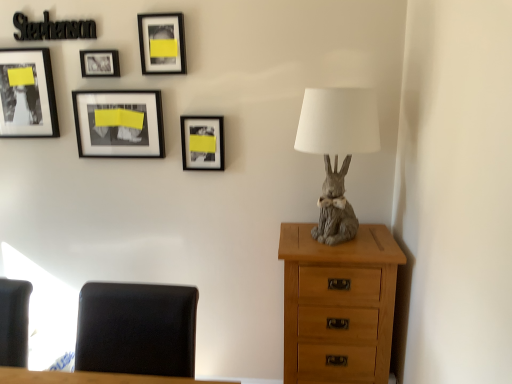
Describe the element at coordinates (99, 63) in the screenshot. I see `matte black picture frame at upper left, marked as the fourth picture frame in a right-to-left arrangement` at that location.

In order to click on matte black frame at upper center, which is counted as the 2th picture frame, starting from the right in this screenshot , I will do `click(162, 43)`.

Image resolution: width=512 pixels, height=384 pixels. Describe the element at coordinates (338, 304) in the screenshot. I see `light brown wood chest of drawers at right` at that location.

At what (x,y) coordinates should I click in order to perform the action: click on matte black picture frame at center, which is the first picture frame in right-to-left order. Please return your answer as a coordinate pair (x, y). This screenshot has width=512, height=384. Looking at the image, I should click on (202, 142).

What do you see at coordinates (202, 142) in the screenshot? I see `matte black picture frame at center, which is the first picture frame in right-to-left order` at bounding box center [202, 142].

Where is `gray textured rabbit at right`? Image resolution: width=512 pixels, height=384 pixels. gray textured rabbit at right is located at coordinates (337, 149).

How far apart are black leather chair at lower left and matte black picture frame at upper left, the 2th picture frame in the left-to-right sequence?

The distance of black leather chair at lower left from matte black picture frame at upper left, the 2th picture frame in the left-to-right sequence, is 1.18 meters.

Locate an element on the screen. The width and height of the screenshot is (512, 384). furniture located below the matte black picture frame at upper left, marked as the fourth picture frame in a right-to-left arrangement (from the image's perspective) is located at coordinates (136, 329).

Considering the sizes of objects black leather chair at lower left and matte black picture frame at upper left, marked as the fourth picture frame in a right-to-left arrangement, in the image provided, who is wider, black leather chair at lower left or matte black picture frame at upper left, marked as the fourth picture frame in a right-to-left arrangement,?

black leather chair at lower left.

Is black leather chair at lower left bigger or smaller than matte black picture frame at upper left, marked as the fourth picture frame in a right-to-left arrangement?

black leather chair at lower left is bigger than matte black picture frame at upper left, marked as the fourth picture frame in a right-to-left arrangement.

Is matte black picture frame at center, which is counted as the fifth picture frame, starting from the left, oriented away from matte black frame at upper center, marked as the 4th picture frame in a left-to-right arrangement?

No.

How many degrees apart are the facing directions of matte black picture frame at center, which is counted as the fifth picture frame, starting from the left, and matte black frame at upper center, marked as the 4th picture frame in a left-to-right arrangement?

The angular difference between matte black picture frame at center, which is counted as the fifth picture frame, starting from the left, and matte black frame at upper center, marked as the 4th picture frame in a left-to-right arrangement, is 0.00259 degrees.

From the picture: Considering the sizes of objects matte black picture frame at center, which is counted as the fifth picture frame, starting from the left, and matte black frame at upper center, marked as the 4th picture frame in a left-to-right arrangement, in the image provided, who is thinner, matte black picture frame at center, which is counted as the fifth picture frame, starting from the left, or matte black frame at upper center, marked as the 4th picture frame in a left-to-right arrangement,?

With smaller width is matte black frame at upper center, marked as the 4th picture frame in a left-to-right arrangement.

How much distance is there between matte black picture frame at center, which is counted as the fifth picture frame, starting from the left, and matte black frame at upper center, marked as the 4th picture frame in a left-to-right arrangement?

They are 13.73 inches apart.

From the image's perspective, is light brown wood chest of drawers at right positioned above or below gray textured rabbit at right?

light brown wood chest of drawers at right is situated lower than gray textured rabbit at right in the image.

Which is more to the left, light brown wood chest of drawers at right or gray textured rabbit at right?

From the viewer's perspective, gray textured rabbit at right appears more on the left side.

From a real-world perspective, is light brown wood chest of drawers at right physically located above or below gray textured rabbit at right?

Clearly, from a real-world perspective, light brown wood chest of drawers at right is below gray textured rabbit at right.

Is light brown wood chest of drawers at right inside or outside of matte black frame at upper left, which ranks as the first picture frame in left-to-right order?

The correct answer is: outside.

Where is `the 5th picture frame to the left of the light brown wood chest of drawers at right, starting your count from the anchor`? The image size is (512, 384). the 5th picture frame to the left of the light brown wood chest of drawers at right, starting your count from the anchor is located at coordinates (27, 94).

Considering the sizes of light brown wood chest of drawers at right and matte black frame at upper left, the fifth picture frame in the right-to-left sequence, in the image, is light brown wood chest of drawers at right taller or shorter than matte black frame at upper left, the fifth picture frame in the right-to-left sequence,?

light brown wood chest of drawers at right is taller than matte black frame at upper left, the fifth picture frame in the right-to-left sequence.

Who is more distant, light brown wood chest of drawers at right or matte black frame at upper left, the fifth picture frame in the right-to-left sequence?

matte black frame at upper left, the fifth picture frame in the right-to-left sequence, is more distant.

Is black matte picture frame at upper left, the 3th picture frame from the right, positioned beyond the bounds of matte black picture frame at center, which is counted as the fifth picture frame, starting from the left?

That's correct, black matte picture frame at upper left, the 3th picture frame from the right, is outside of matte black picture frame at center, which is counted as the fifth picture frame, starting from the left.

Which picture frame is the 1st one when counting from the front of the black matte picture frame at upper left, arranged as the third picture frame when viewed from the left? Please provide its 2D coordinates.

[(202, 142)]

How many degrees apart are the facing directions of black matte picture frame at upper left, the 3th picture frame from the right, and matte black picture frame at center, which is counted as the fifth picture frame, starting from the left?

There is a 0.00261-degree angle between the facing directions of black matte picture frame at upper left, the 3th picture frame from the right, and matte black picture frame at center, which is counted as the fifth picture frame, starting from the left.

From a real-world perspective, is matte black frame at upper center, marked as the 4th picture frame in a left-to-right arrangement, physically located above or below matte black picture frame at center, which is counted as the fifth picture frame, starting from the left?

From a real-world perspective, matte black frame at upper center, marked as the 4th picture frame in a left-to-right arrangement, is physically above matte black picture frame at center, which is counted as the fifth picture frame, starting from the left.

Is the surface of matte black frame at upper center, which is counted as the 2th picture frame, starting from the right, in direct contact with matte black picture frame at center, which is counted as the fifth picture frame, starting from the left?

No, matte black frame at upper center, which is counted as the 2th picture frame, starting from the right, is not making contact with matte black picture frame at center, which is counted as the fifth picture frame, starting from the left.

How different are the orientations of matte black frame at upper center, which is counted as the 2th picture frame, starting from the right, and matte black picture frame at center, which is the first picture frame in right-to-left order, in degrees?

The angular difference between matte black frame at upper center, which is counted as the 2th picture frame, starting from the right, and matte black picture frame at center, which is the first picture frame in right-to-left order, is 0.00259 degrees.

Is matte black frame at upper center, marked as the 4th picture frame in a left-to-right arrangement, bigger or smaller than matte black picture frame at center, which is the first picture frame in right-to-left order?

Considering their sizes, matte black frame at upper center, marked as the 4th picture frame in a left-to-right arrangement, takes up more space than matte black picture frame at center, which is the first picture frame in right-to-left order.

From a real-world perspective, starting from the gray textured rabbit at right, which picture frame is the 1st one vertically above it? Please provide its 2D coordinates.

[(202, 142)]

Is matte black picture frame at center, which is counted as the fifth picture frame, starting from the left, in front of gray textured rabbit at right?

No.

Would you say matte black picture frame at center, which is the first picture frame in right-to-left order, is to the left or to the right of gray textured rabbit at right in the picture?

In the image, matte black picture frame at center, which is the first picture frame in right-to-left order, appears on the left side of gray textured rabbit at right.

Is matte black picture frame at center, which is counted as the fifth picture frame, starting from the left, oriented towards gray textured rabbit at right?

No, matte black picture frame at center, which is counted as the fifth picture frame, starting from the left, is not facing towards gray textured rabbit at right.

Starting from the black leather chair at lower left, which picture frame is the 3rd one to the left? Please provide its 2D coordinates.

[(99, 63)]

Locate an element on the screen. The image size is (512, 384). the 2nd picture frame in front of the matte black picture frame at center, which is the first picture frame in right-to-left order is located at coordinates (162, 43).

Which object lies further to the anchor point black matte picture frame at upper left, arranged as the third picture frame when viewed from the left, light brown wood chest of drawers at right or matte black frame at upper left, the fifth picture frame in the right-to-left sequence?

Among the two, light brown wood chest of drawers at right is located further to black matte picture frame at upper left, arranged as the third picture frame when viewed from the left.

Based on the photo, considering their positions, is black matte picture frame at upper left, the 3th picture frame from the right, positioned closer to matte black frame at upper center, which is counted as the 2th picture frame, starting from the right, than matte black frame at upper left, which ranks as the first picture frame in left-to-right order?

black matte picture frame at upper left, the 3th picture frame from the right, is positioned closer to the anchor matte black frame at upper center, which is counted as the 2th picture frame, starting from the right.

When comparing their distances from matte black picture frame at center, which is counted as the fifth picture frame, starting from the left, does light brown wood chest of drawers at right or black leather chair at lower left seem further?

black leather chair at lower left lies further to matte black picture frame at center, which is counted as the fifth picture frame, starting from the left, than the other object.

Based on their spatial positions, is matte black picture frame at upper left, the 2th picture frame in the left-to-right sequence, or light brown wood chest of drawers at right further from black leather chair at lower left?

Based on the image, matte black picture frame at upper left, the 2th picture frame in the left-to-right sequence, appears to be further to black leather chair at lower left.

From the image, which object appears to be nearer to light brown wood chest of drawers at right, matte black picture frame at center, which is the first picture frame in right-to-left order, or matte black frame at upper left, the fifth picture frame in the right-to-left sequence?

Based on the image, matte black picture frame at center, which is the first picture frame in right-to-left order, appears to be nearer to light brown wood chest of drawers at right.

When comparing their distances from matte black picture frame at upper left, the 2th picture frame in the left-to-right sequence, does gray textured rabbit at right or matte black picture frame at center, which is counted as the fifth picture frame, starting from the left, seem further?

The object further to matte black picture frame at upper left, the 2th picture frame in the left-to-right sequence, is gray textured rabbit at right.

From the image, which object appears to be farther from matte black frame at upper center, which is counted as the 2th picture frame, starting from the right, black leather chair at lower left or matte black picture frame at center, which is counted as the fifth picture frame, starting from the left?

Based on the image, black leather chair at lower left appears to be further to matte black frame at upper center, which is counted as the 2th picture frame, starting from the right.

When comparing their distances from black matte picture frame at upper left, the 3th picture frame from the right, does light brown wood chest of drawers at right or matte black picture frame at center, which is the first picture frame in right-to-left order, seem further?

light brown wood chest of drawers at right is further to black matte picture frame at upper left, the 3th picture frame from the right.

Locate an element on the screen. The width and height of the screenshot is (512, 384). table lamp between matte black frame at upper left, the fifth picture frame in the right-to-left sequence, and light brown wood chest of drawers at right, in the horizontal direction is located at coordinates (337, 149).

Image resolution: width=512 pixels, height=384 pixels. I want to click on table lamp between black matte picture frame at upper left, arranged as the third picture frame when viewed from the left, and light brown wood chest of drawers at right from left to right, so click(x=337, y=149).

Where is `table lamp that lies between matte black picture frame at center, which is the first picture frame in right-to-left order, and black leather chair at lower left from top to bottom`? table lamp that lies between matte black picture frame at center, which is the first picture frame in right-to-left order, and black leather chair at lower left from top to bottom is located at coordinates (337, 149).

You are a GUI agent. You are given a task and a screenshot of the screen. Output one action in this format:
    pyautogui.click(x=<x>, y=<y>)
    Task: Click on the furniture that lies between black matte picture frame at upper left, arranged as the third picture frame when viewed from the left, and light brown wood chest of drawers at right from top to bottom
    This screenshot has height=384, width=512.
    Given the screenshot: What is the action you would take?
    pyautogui.click(x=136, y=329)